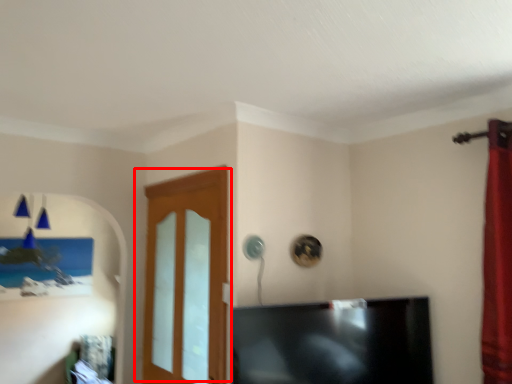
Question: Considering the relative positions of door (annotated by the red box) and television in the image provided, where is door (annotated by the red box) located with respect to the staircase?

Choices:
 (A) right
 (B) left

Answer: (B)